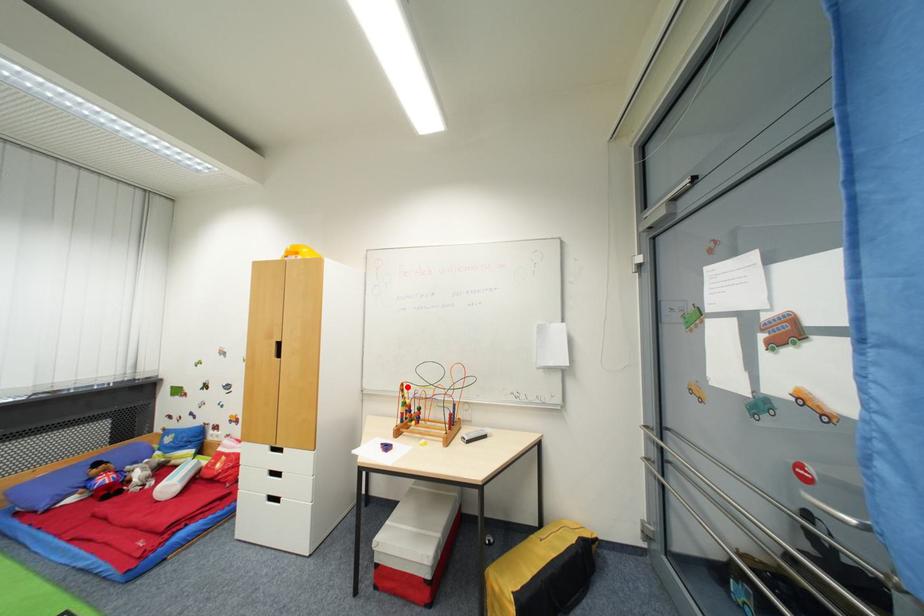
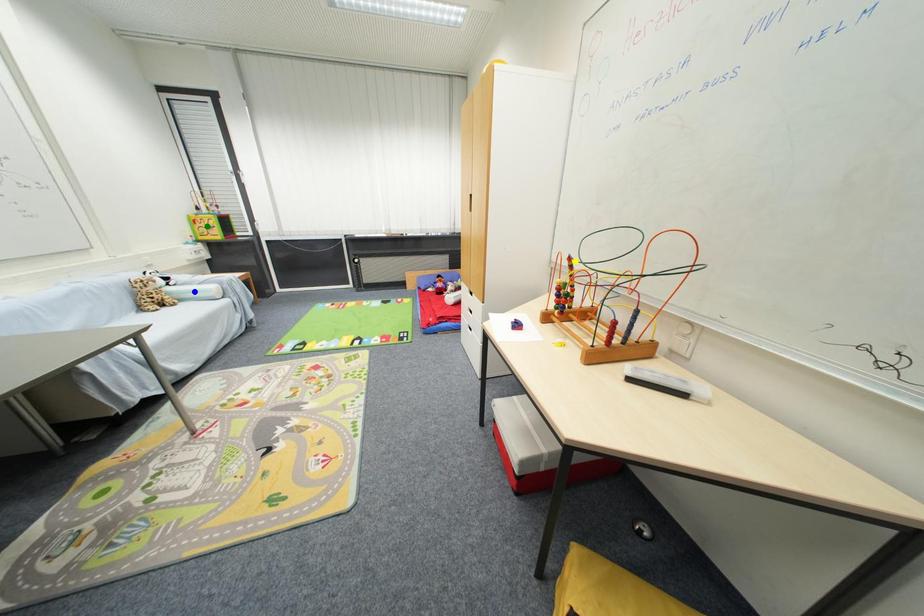
Question: I am providing you with two images of the same scene from different viewpoints. A red point is marked on the first image. You are given multiple points on the second image. Which point in image 2 represents the same 3d spot as the red point in image 1?

Choices:
 (A) yellow point
 (B) blue point
 (C) green point

Answer: (A)